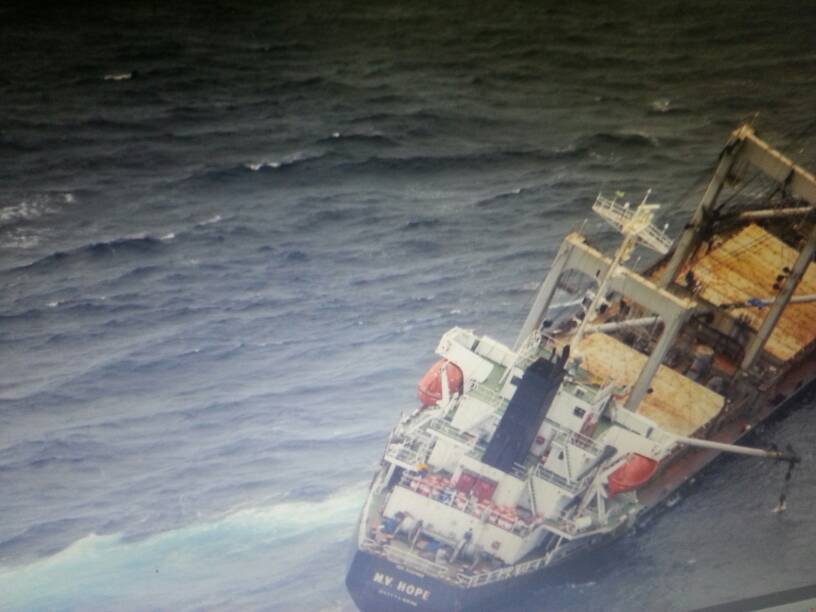
Find the location of a particular element. Image resolution: width=816 pixels, height=612 pixels. desks on ship is located at coordinates (472, 562), (520, 513), (450, 428), (494, 392), (537, 359).